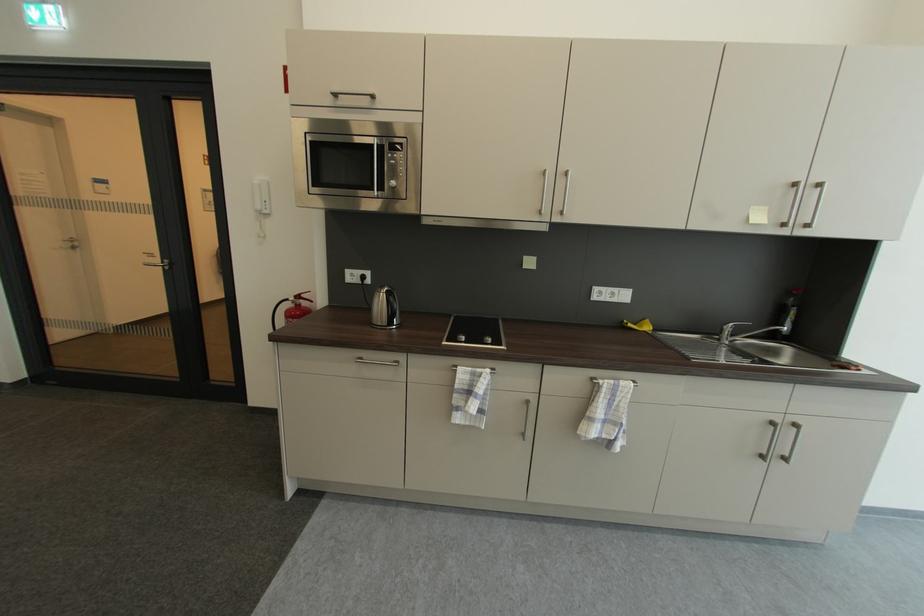
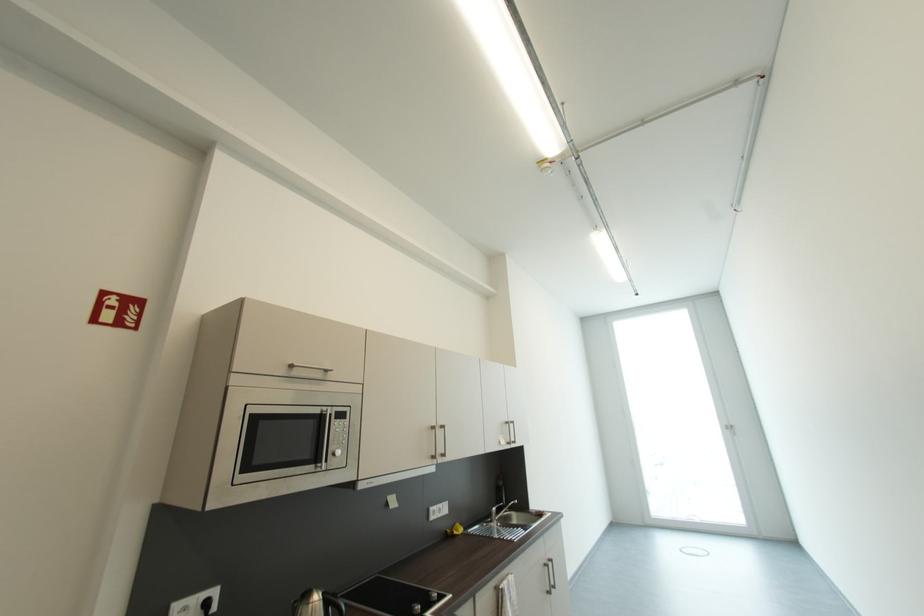
Where in the second image is the point corresponding to point 723,339 from the first image?

(495, 522)